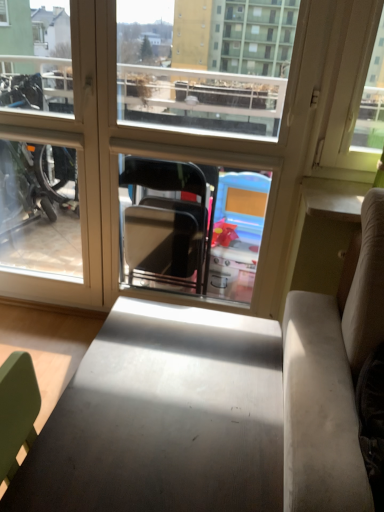
Find the location of a particular element. This screenshot has width=384, height=512. vacant area on top of matte gray table at center (from a real-world perspective) is located at coordinates (169, 386).